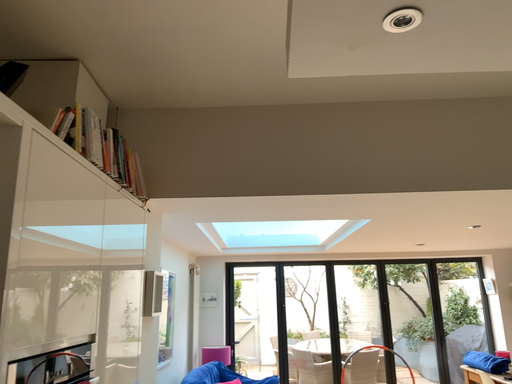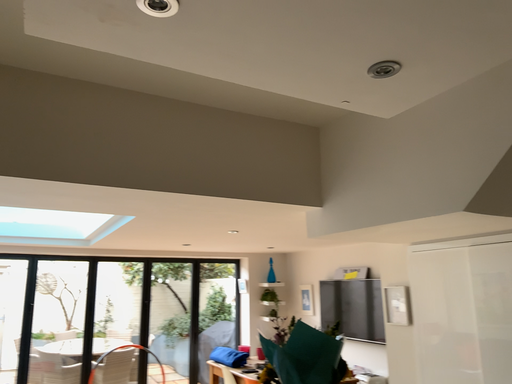
Question: Which way did the camera rotate in the video?

Choices:
 (A) rotated left
 (B) rotated right

Answer: (B)